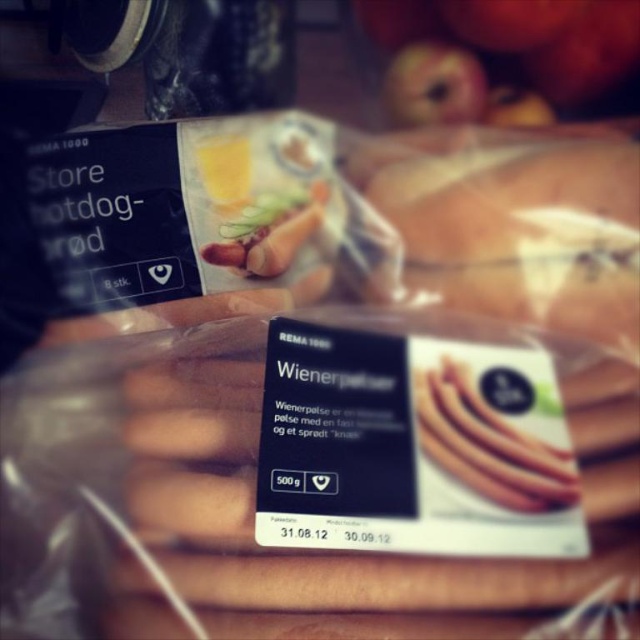
Does translucent plastic bag at center have a greater height compared to smooth red apple at upper center?

Yes.

Does point (422, 230) come behind point (392, 83)?

No, it is in front of (392, 83).

The height and width of the screenshot is (640, 640). I want to click on translucent plastic bag at center, so click(524, 230).